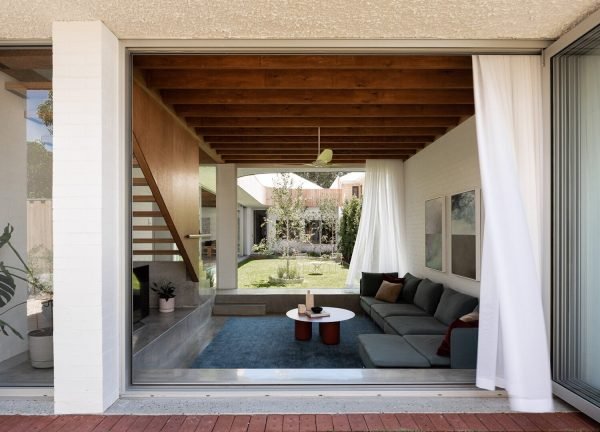
Locate an element on the screen. coffee table leg is located at coordinates (303, 332), (333, 337).